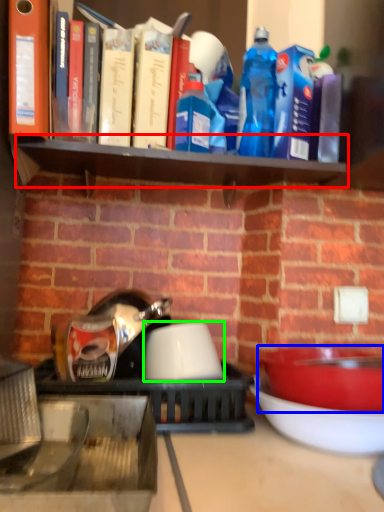
Question: Which object is the closest to the shelf (highlighted by a red box)? Choose among these: bowl (highlighted by a blue box) or bowl (highlighted by a green box).

Choices:
 (A) bowl
 (B) bowl

Answer: (B)